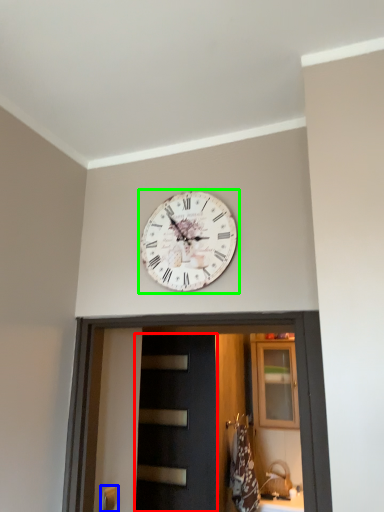
Question: Based on their relative distances, which object is farther from door (highlighted by a red box)? Choose from door handle (highlighted by a blue box) and wall clock (highlighted by a green box).

Choices:
 (A) door handle
 (B) wall clock

Answer: (B)